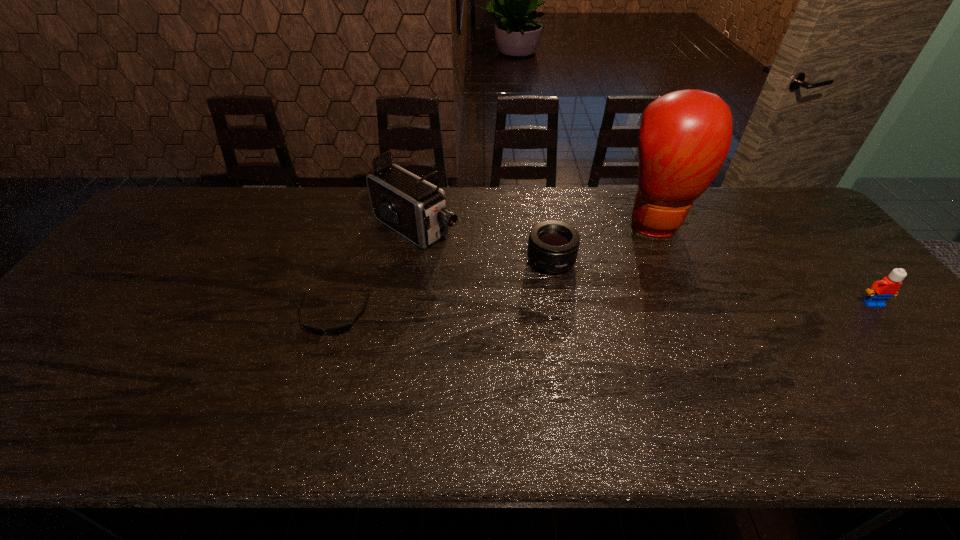
The width and height of the screenshot is (960, 540). Identify the location of free space between the boxing glove and the sunglasses. (495, 270).

In order to click on unoccupied position between the sunglasses and the second object from right to left in this screenshot , I will do `click(495, 270)`.

What are the coordinates of `empty space that is in between the camcorder and the shortest object` in the screenshot? It's located at (374, 272).

This screenshot has width=960, height=540. What are the coordinates of `free space between the shortest object and the second object from right to left` in the screenshot? It's located at (495, 270).

At what (x,y) coordinates should I click in order to perform the action: click on unoccupied position between the second shortest object and the shortest object. Please return your answer as a coordinate pair (x, y). Image resolution: width=960 pixels, height=540 pixels. Looking at the image, I should click on (443, 289).

Locate an element on the screen. The image size is (960, 540). free space between the tallest object and the camcorder is located at coordinates (536, 225).

Where is `vacant point located between the second tallest object and the boxing glove`? vacant point located between the second tallest object and the boxing glove is located at coordinates (536, 225).

Select which object is the second closest to the camcorder. Please provide its 2D coordinates. Your answer should be formatted as a tuple, i.e. [(x, y)], where the tuple contains the x and y coordinates of a point satisfying the conditions above.

[(553, 246)]

The image size is (960, 540). I want to click on object identified as the third closest to the second tallest object, so click(684, 138).